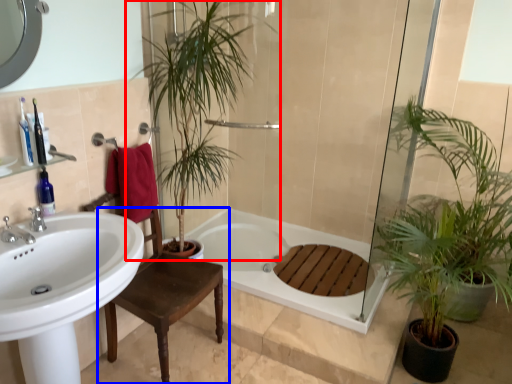
Question: Which object appears farthest to the camera in this image, houseplant (highlighted by a red box) or chair (highlighted by a blue box)?

Choices:
 (A) houseplant
 (B) chair

Answer: (A)